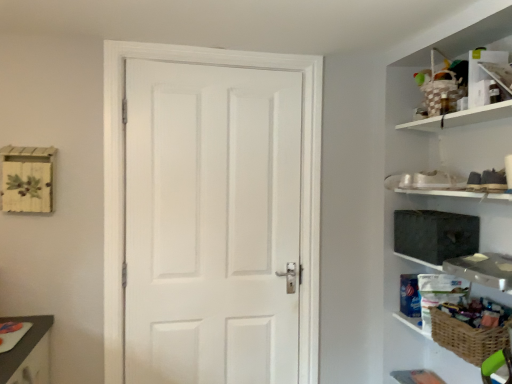
Question: From a real-world perspective, relative to white matte door at center, is dark gray fabric medicine cabinet at right vertically above or below?

Choices:
 (A) above
 (B) below

Answer: (A)

Question: Considering the positions of dark gray fabric medicine cabinet at right and white matte door at center in the image, is dark gray fabric medicine cabinet at right bigger or smaller than white matte door at center?

Choices:
 (A) small
 (B) big

Answer: (A)

Question: Estimate the real-world distances between objects in this image. Which object is closer to the white matte door at center?

Choices:
 (A) woven brown basket at lower right
 (B) dark gray fabric medicine cabinet at right
 (C) woven wicker basket at right

Answer: (B)

Question: Which is farther from the white matte door at center?

Choices:
 (A) woven brown basket at lower right
 (B) woven wicker basket at right
 (C) dark gray fabric medicine cabinet at right

Answer: (A)